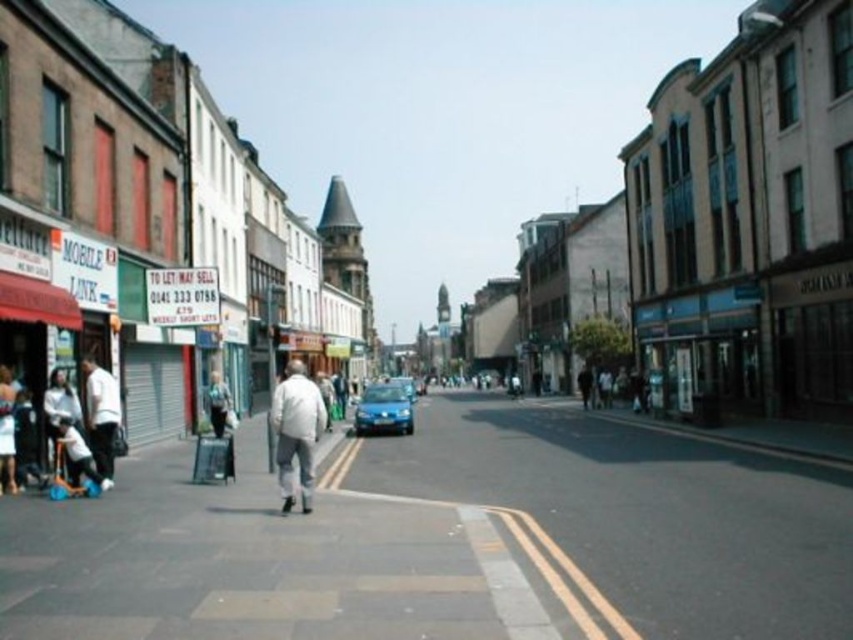
Which of these two, white matte jacket at center or white matte jacket at lower left, stands shorter?

Standing shorter between the two is white matte jacket at lower left.

Who is more forward, (322, 403) or (113, 444)?

Positioned in front is point (322, 403).

Locate an element on the screen. The width and height of the screenshot is (853, 640). white matte jacket at center is located at coordinates (296, 432).

Who is more forward, (318,416) or (363,435)?

Point (318,416) is in front.

Is white matte jacket at center further to camera compared to satin blue car at center?

No, it is in front of satin blue car at center.

What do you see at coordinates (296, 432) in the screenshot? The image size is (853, 640). I see `white matte jacket at center` at bounding box center [296, 432].

Image resolution: width=853 pixels, height=640 pixels. What are the coordinates of `white matte jacket at center` in the screenshot? It's located at (296, 432).

Which is more to the right, smooth concrete pavement at lower left or blue metallic car at center?

Positioned to the right is smooth concrete pavement at lower left.

Between smooth concrete pavement at lower left and blue metallic car at center, which one is positioned higher?

smooth concrete pavement at lower left is higher up.

Measure the distance between smooth concrete pavement at lower left and camera.

A distance of 6.48 meters exists between smooth concrete pavement at lower left and camera.

Where is `smooth concrete pavement at lower left`? smooth concrete pavement at lower left is located at coordinates (444, 540).